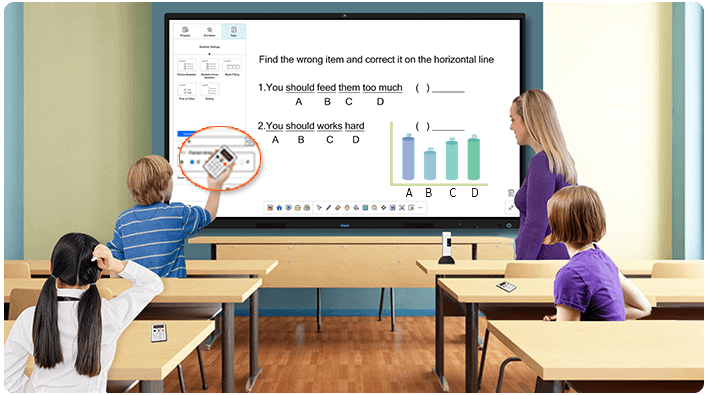
Locate an element on the screen. The image size is (707, 395). screen is located at coordinates (363, 95).